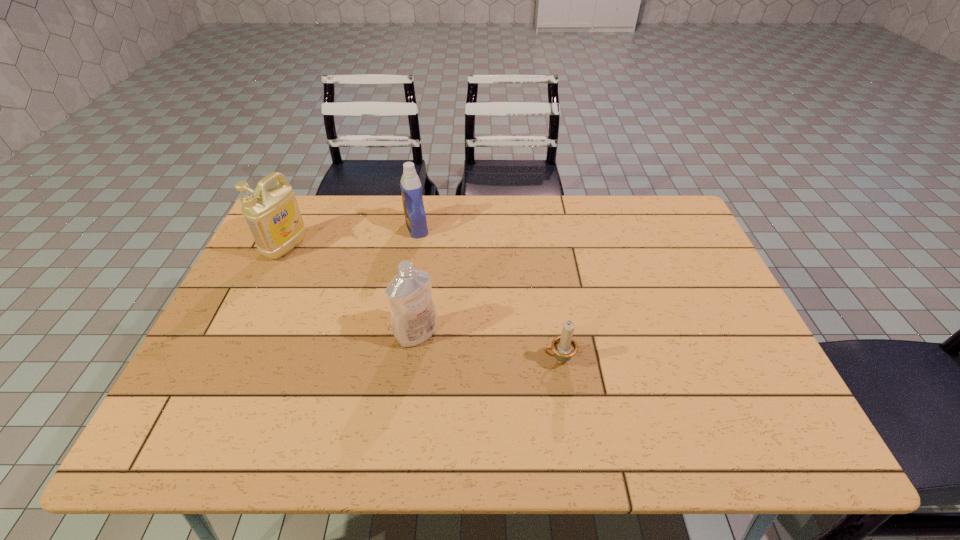
Where is `the leftmost object`? the leftmost object is located at coordinates click(x=272, y=214).

The image size is (960, 540). What are the coordinates of `the nearest detergent` in the screenshot? It's located at (414, 320).

The height and width of the screenshot is (540, 960). In order to click on the shortest object in this screenshot , I will do `click(564, 347)`.

At what (x,y) coordinates should I click in order to perform the action: click on the rightmost object. Please return your answer as a coordinate pair (x, y). The image size is (960, 540). Looking at the image, I should click on (564, 347).

Identify the location of blank space located on the front of the leftmost object. The height and width of the screenshot is (540, 960). (252, 321).

What are the coordinates of `blank area located on the right of the nearest detergent` in the screenshot? It's located at click(x=531, y=334).

This screenshot has height=540, width=960. I want to click on blank space located 0.290m on the handle side of the rightmost object, so click(x=424, y=360).

Where is `free region located 0.330m on the handle side of the rightmost object`? The width and height of the screenshot is (960, 540). free region located 0.330m on the handle side of the rightmost object is located at coordinates (408, 360).

Image resolution: width=960 pixels, height=540 pixels. Identify the location of free spot located on the handle side of the rightmost object. (453, 360).

This screenshot has height=540, width=960. Find the location of `object that is at the left edge`. object that is at the left edge is located at coordinates (272, 214).